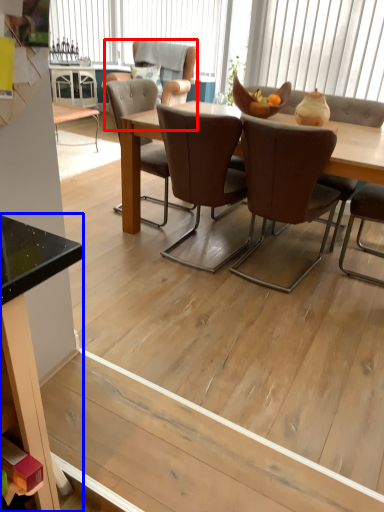
Question: Among these objects, which one is farthest to the camera, chair (highlighted by a red box) or desk (highlighted by a blue box)?

Choices:
 (A) chair
 (B) desk

Answer: (A)